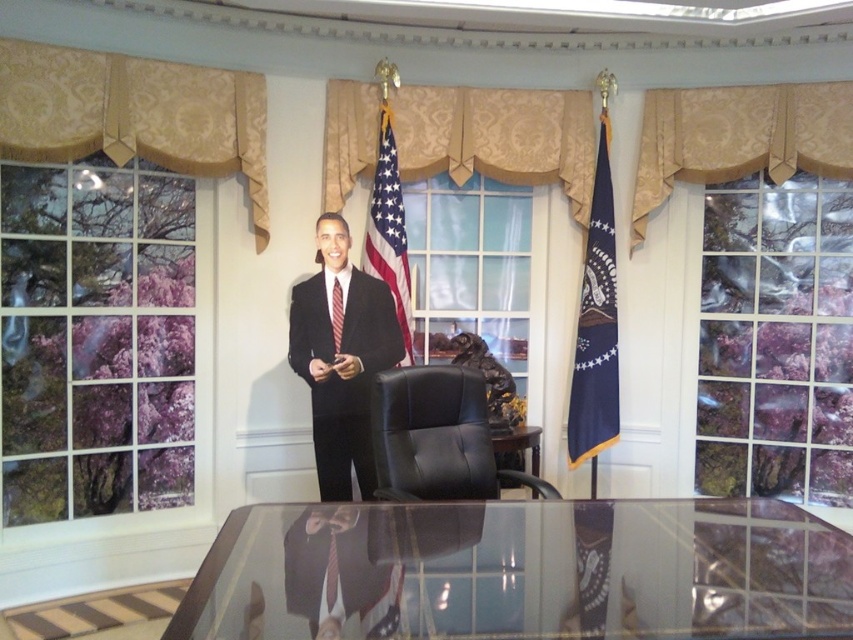
Based on the provided coordinates, where exactly is the black leather chair at center located in the image?

The black leather chair at center is located at point coordinates of 0.684 on the x axis and 0.513 on the y axis.

You are a decorator planning to hang a new picture frame between the gold damask valance at upper center and the red silk tie at center. Which object should the frame be placed closer to if it needs to be centered vertically between them?

The gold damask valance at upper center is taller than the red silk tie at center, so to center the frame vertically between them, it should be placed closer to the red silk tie at center.